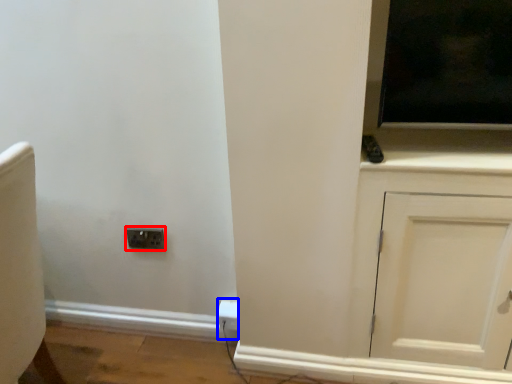
Question: Which point is further to the camera, socket (highlighted by a red box) or electric outlet (highlighted by a blue box)?

Choices:
 (A) socket
 (B) electric outlet

Answer: (B)